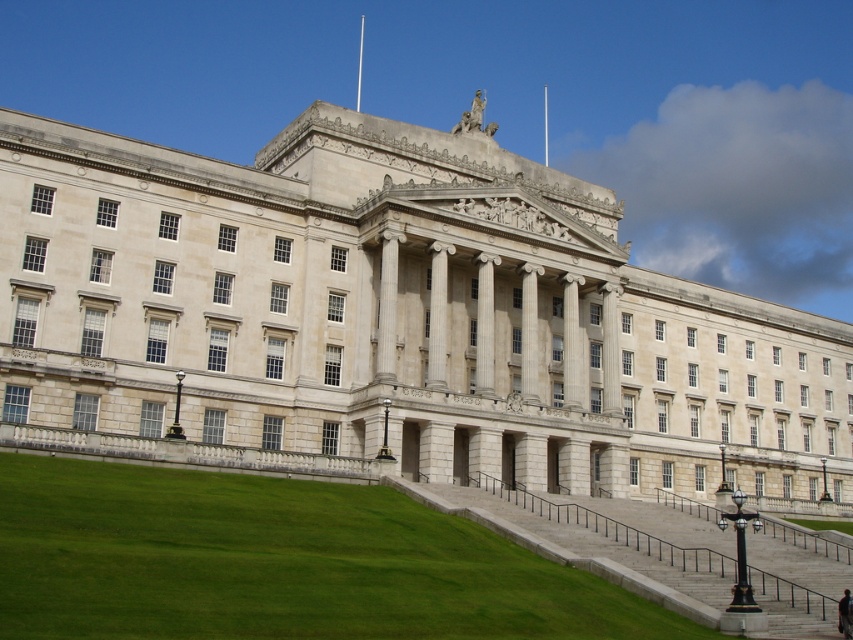
Between white stone building at center and green grass at lower left, which one is positioned lower?

green grass at lower left is lower down.

Is the position of white stone building at center more distant than that of green grass at lower left?

Yes, white stone building at center is further from the viewer.

The image size is (853, 640). I want to click on white stone building at center, so click(x=396, y=314).

You are a GUI agent. You are given a task and a screenshot of the screen. Output one action in this format:
    pyautogui.click(x=<x>, y=<y>)
    Task: Click on the white stone building at center
    
    Given the screenshot: What is the action you would take?
    pyautogui.click(x=396, y=314)